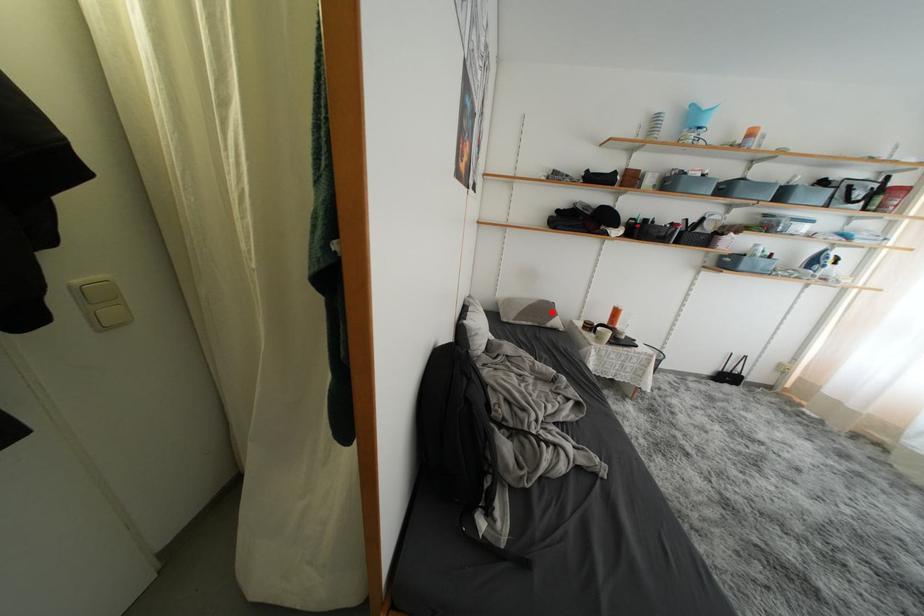
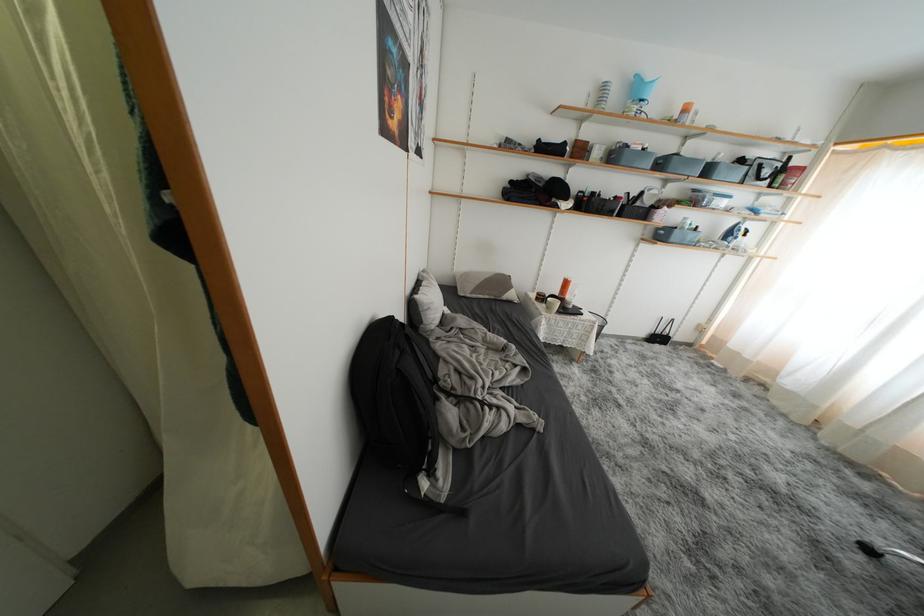
Question: A red point is marked in image1. In image2, is the corresponding 3D point closer to the camera or farther? Reply with the corresponding letter.

Choices:
 (A) The corresponding 3D point is closer.
 (B) The corresponding 3D point is farther.

Answer: (A)